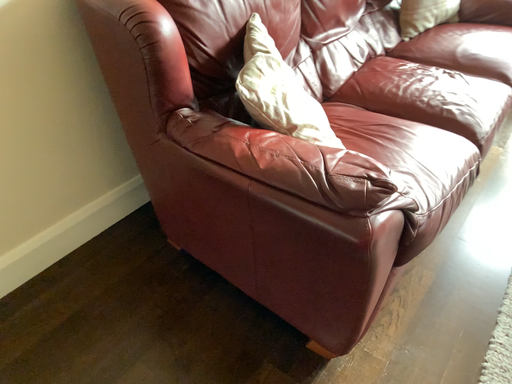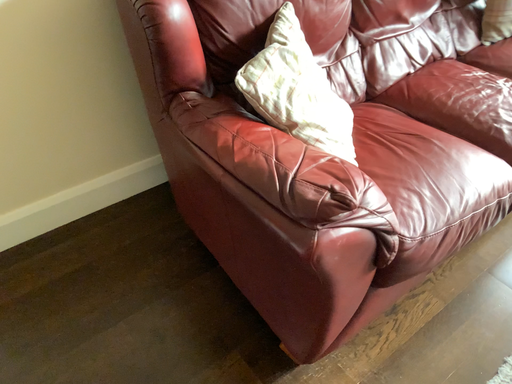
Question: Which way did the camera rotate in the video?

Choices:
 (A) rotated right
 (B) rotated left

Answer: (B)